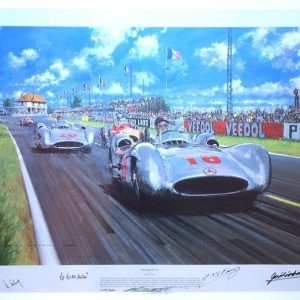
Identify the location of stands. This screenshot has height=300, width=300. (133, 106), (110, 107), (95, 107), (77, 109), (59, 110).